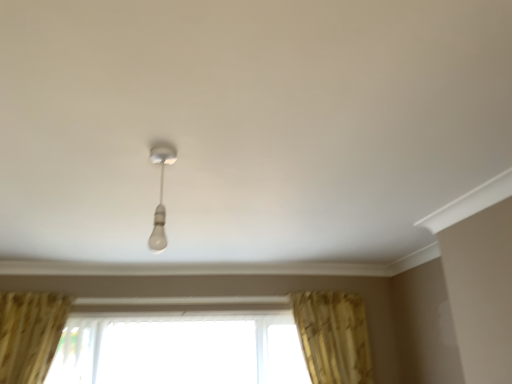
Question: In terms of size, does gold textured curtain at lower right appear bigger or smaller than transparent glass window at center?

Choices:
 (A) big
 (B) small

Answer: (B)

Question: Is point (314, 355) closer or farther from the camera than point (205, 329)?

Choices:
 (A) closer
 (B) farther

Answer: (A)

Question: Estimate the real-world distances between objects in this image. Which object is farther from the white glossy bulb at center?

Choices:
 (A) transparent glass window at center
 (B) gold textured curtain at lower right

Answer: (B)

Question: Which object is positioned farthest from the gold textured curtain at lower right?

Choices:
 (A) white glossy bulb at center
 (B) transparent glass window at center

Answer: (A)